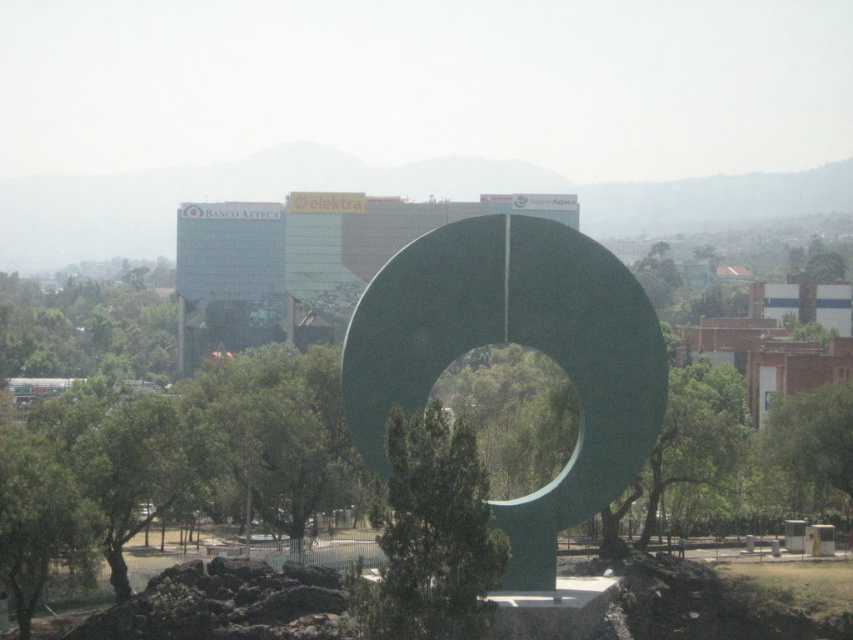
Can you confirm if green polished stone circle at center is positioned to the right of green leafy tree at center?

No, green polished stone circle at center is not to the right of green leafy tree at center.

Is green polished stone circle at center below green leafy tree at center?

No.

Describe the element at coordinates (519, 344) in the screenshot. I see `green polished stone circle at center` at that location.

Identify the location of green polished stone circle at center. (519, 344).

Between point (457, 442) and point (827, 461), which one is positioned in front?

Point (457, 442) is in front.

Measure the distance between green matte tree at center and green leafy tree at center.

A distance of 173.24 feet exists between green matte tree at center and green leafy tree at center.

Which is behind, point (401, 566) or point (838, 444)?

Point (838, 444)

What are the coordinates of `green matte tree at center` in the screenshot? It's located at (431, 534).

Does green polished stone sculpture at center have a lesser width compared to green leafy tree at center?

Incorrect, green polished stone sculpture at center's width is not less than green leafy tree at center's.

Is point (32, 600) positioned before point (779, 417)?

Yes.

Is point (277, 426) positioned behind point (831, 397)?

That is False.

You are a GUI agent. You are given a task and a screenshot of the screen. Output one action in this format:
    pyautogui.click(x=<x>, y=<y>)
    Task: Click on the green polished stone sculpture at center
    
    Given the screenshot: What is the action you would take?
    pyautogui.click(x=167, y=461)